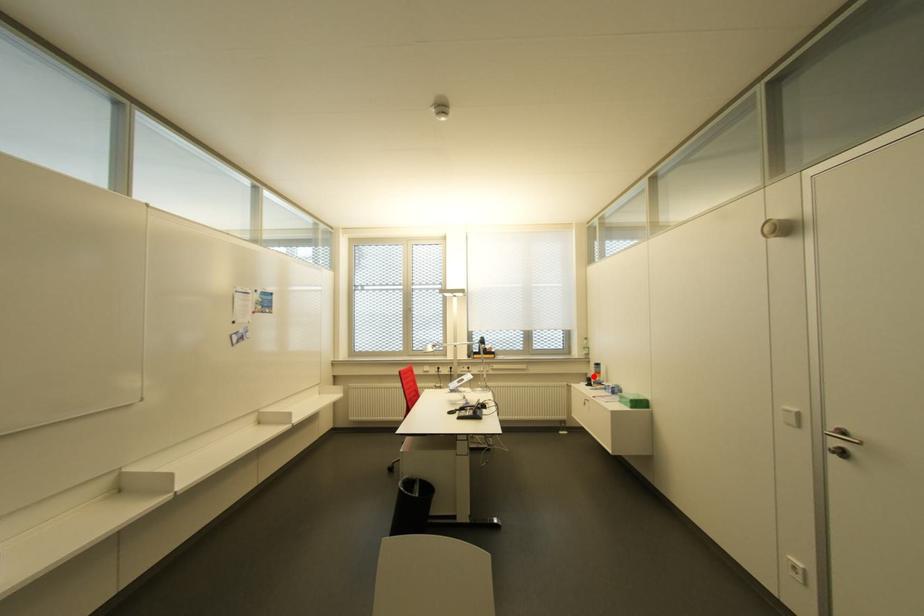
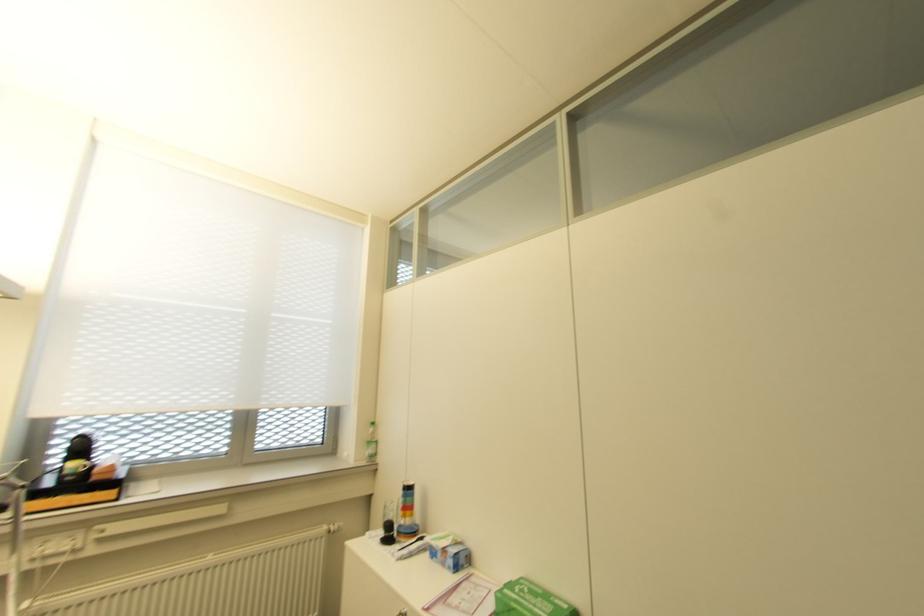
Question: I am providing you with two images of the same scene from different viewpoints. A red point is marked on the first image. At the location where the point appears in image 1, is it still visible in image 2?

Choices:
 (A) Yes
 (B) No

Answer: (A)